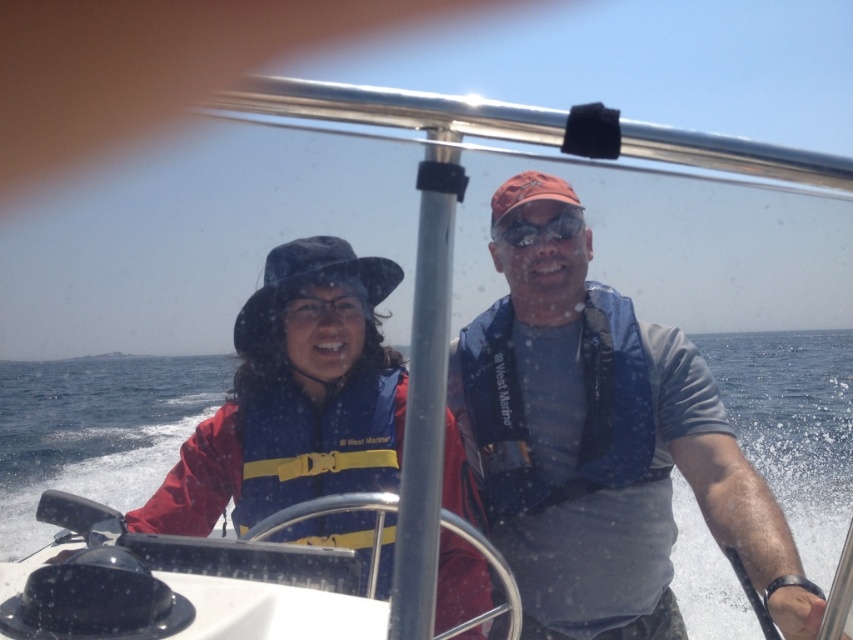
Does blue life vest at center appear over matte black goggles at center?

No.

Find the location of a particular element. The image size is (853, 640). blue life vest at center is located at coordinates (294, 397).

What do you see at coordinates (605, 456) in the screenshot?
I see `blue fabric life vest at center` at bounding box center [605, 456].

How much distance is there between blue fabric life vest at center and blue life vest at center?

They are 19.79 inches apart.

The height and width of the screenshot is (640, 853). I want to click on blue fabric life vest at center, so click(605, 456).

The height and width of the screenshot is (640, 853). Identify the location of blue fabric life vest at center. (605, 456).

Is point (503, 305) positioned in front of point (526, 234)?

No, it is behind (526, 234).

Who is more forward, (x=663, y=536) or (x=520, y=227)?

Point (x=663, y=536) is in front.

In order to click on blue fabric life vest at center in this screenshot , I will do `click(605, 456)`.